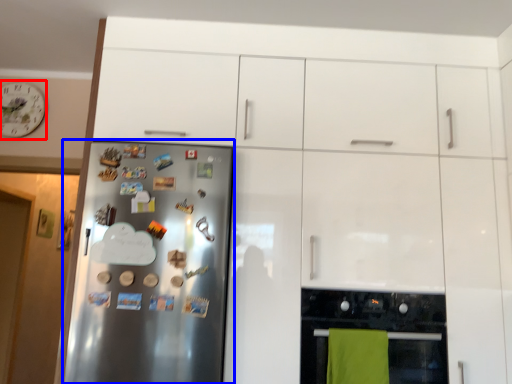
Question: Among these objects, which one is farthest to the camera, clock (highlighted by a red box) or refrigerator (highlighted by a blue box)?

Choices:
 (A) clock
 (B) refrigerator

Answer: (A)